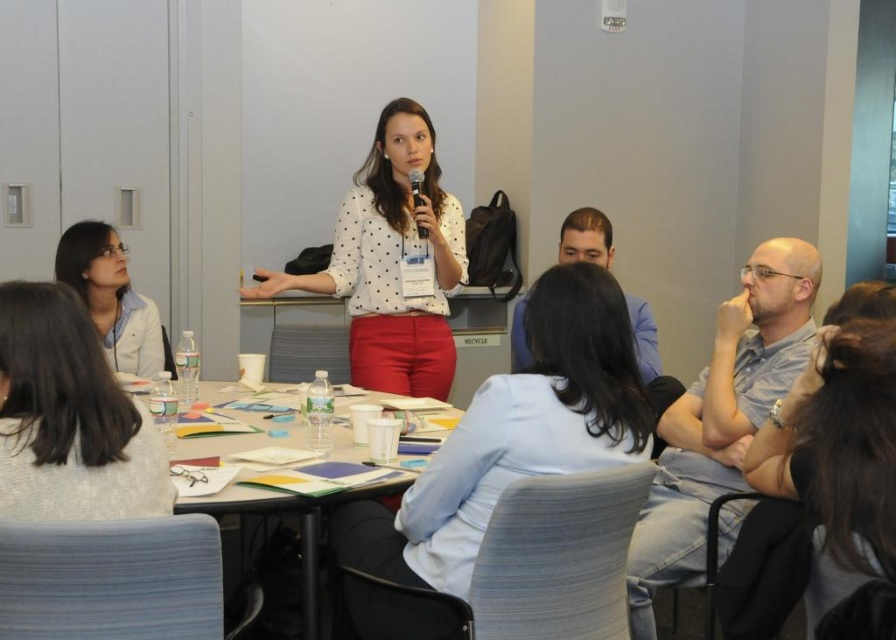
Who is lower down, gray knit sweater at lower left or matte black microphone at center?

gray knit sweater at lower left is below.

Who is more forward, (42, 305) or (420, 188)?

Point (42, 305) is more forward.

The image size is (896, 640). I want to click on gray knit sweater at lower left, so click(69, 417).

Does white dotted shirt at center have a greater width compared to matte black microphone at center?

Indeed, white dotted shirt at center has a greater width compared to matte black microphone at center.

Is white dotted shirt at center positioned at the back of matte black microphone at center?

That is False.

Where is `white dotted shirt at center`? The image size is (896, 640). white dotted shirt at center is located at coordinates (392, 260).

At what (x,y) coordinates should I click in order to perform the action: click on white dotted shirt at center. Please return your answer as a coordinate pair (x, y). The image size is (896, 640). Looking at the image, I should click on pos(392,260).

Does black plastic table at center have a lesser height compared to matte black microphone at center?

No.

The image size is (896, 640). I want to click on black plastic table at center, so click(x=299, y=525).